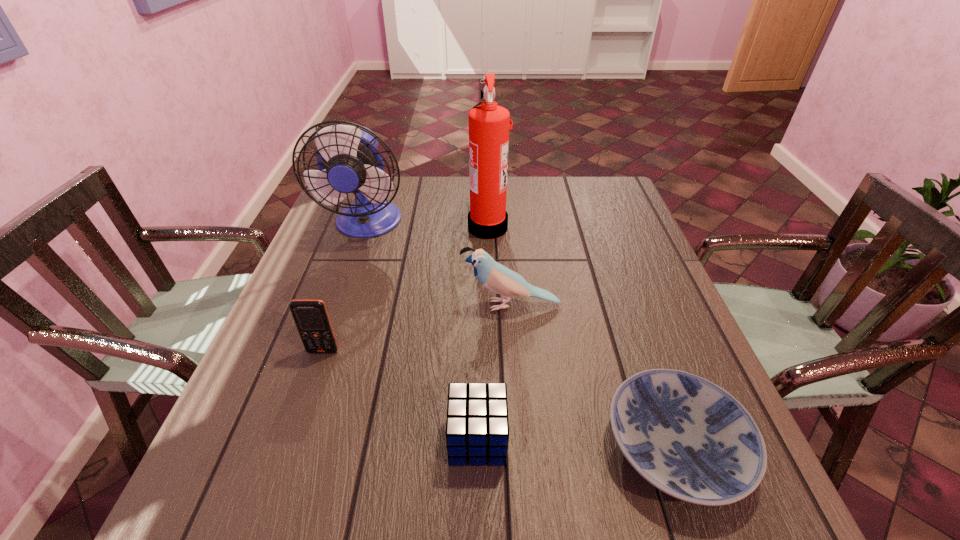
Where is `object at the near edge`? The image size is (960, 540). object at the near edge is located at coordinates (688, 437).

You are a GUI agent. You are given a task and a screenshot of the screen. Output one action in this format:
    pyautogui.click(x=<x>, y=<y>)
    Task: Click on the fan at the left edge
    Image resolution: width=960 pixels, height=540 pixels.
    Given the screenshot: What is the action you would take?
    pyautogui.click(x=349, y=161)

This screenshot has width=960, height=540. I want to click on cellular telephone present at the left edge, so click(x=311, y=317).

The width and height of the screenshot is (960, 540). In order to click on object located at the right edge in this screenshot , I will do `click(688, 437)`.

This screenshot has width=960, height=540. Find the location of `object present at the far left corner`. object present at the far left corner is located at coordinates (349, 161).

Find the location of a particular element. The image size is (960, 540). object positioned at the near right corner is located at coordinates (688, 437).

This screenshot has height=540, width=960. In order to click on vacant space at the far edge of the desktop in this screenshot , I will do `click(421, 187)`.

This screenshot has width=960, height=540. In the image, there is a desktop. Find the location of `vacant space at the near edge`. vacant space at the near edge is located at coordinates (525, 497).

This screenshot has height=540, width=960. What are the coordinates of `vacant point at the left edge` in the screenshot? It's located at (288, 410).

Where is `vacant space at the right edge of the desktop`? vacant space at the right edge of the desktop is located at coordinates (628, 273).